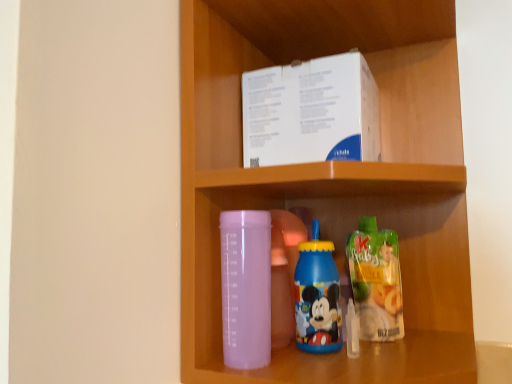
Question: Considering the positions of translucent plastic juice at lower right, which is the 1th bottle in right-to-left order, and matte plastic bottle at lower center in the image, is translucent plastic juice at lower right, which is the 1th bottle in right-to-left order, taller or shorter than matte plastic bottle at lower center?

Choices:
 (A) tall
 (B) short

Answer: (B)

Question: Relative to matte plastic bottle at lower center, is translucent plastic juice at lower right, which is the 1th bottle in right-to-left order, in front or behind?

Choices:
 (A) behind
 (B) front

Answer: (A)

Question: Which is nearer to the matte plastic bottle at lower center?

Choices:
 (A) transparent plastic bottle at center, the third bottle positioned from the right
 (B) translucent plastic juice at lower right, which is the 1th bottle in right-to-left order
 (C) blue plastic bottle at center, the 2th bottle in the left-to-right sequence
 (D) white paperboard box at upper center

Answer: (D)

Question: Based on their relative distances, which object is nearer to the white paperboard box at upper center?

Choices:
 (A) translucent plastic juice at lower right, placed as the third bottle when sorted from left to right
 (B) transparent plastic bottle at center, the first bottle positioned from the left
 (C) blue plastic bottle at center, which is counted as the 2th bottle, starting from the right
 (D) matte plastic bottle at lower center

Answer: (D)